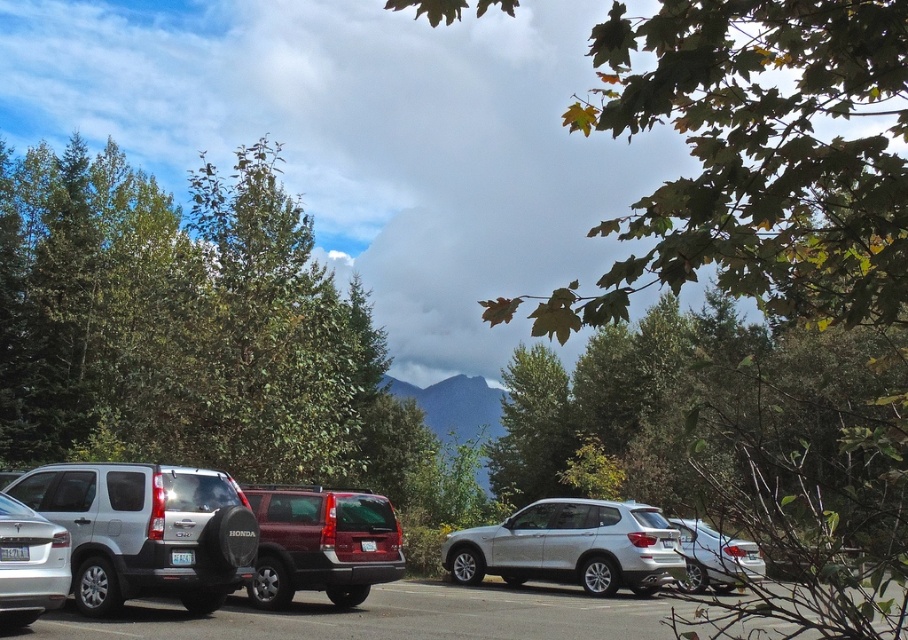
Question: Which point is farther to the camera?

Choices:
 (A) (502, 417)
 (B) (2, 625)
 (C) (696, 560)
 (D) (796, 182)

Answer: (A)

Question: Which point appears farthest from the camera in this image?

Choices:
 (A) (255, 566)
 (B) (664, 541)
 (C) (328, 339)

Answer: (C)

Question: Is green leafy tree at upper center below green leafy tree at left?

Choices:
 (A) no
 (B) yes

Answer: (A)

Question: Can you confirm if matte silver minivan at center-left is smaller than satin silver car at center?

Choices:
 (A) no
 (B) yes

Answer: (B)

Question: Which object is closer to the camera taking this photo?

Choices:
 (A) green leafy tree at center
 (B) matte silver minivan at center-left
 (C) satin silver car at center

Answer: (C)

Question: Does satin silver car at center appear on the right side of matte red suv at center?

Choices:
 (A) no
 (B) yes

Answer: (B)